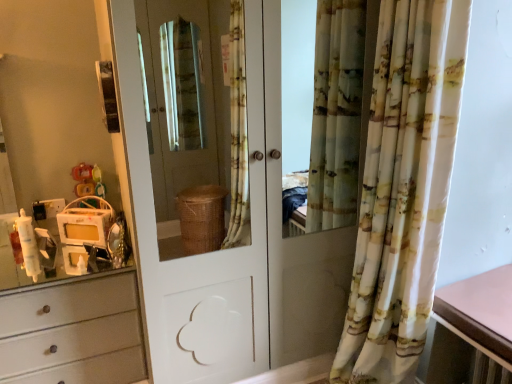
Image resolution: width=512 pixels, height=384 pixels. I want to click on free point above pink laminate table at right (from a real-world perspective), so click(489, 299).